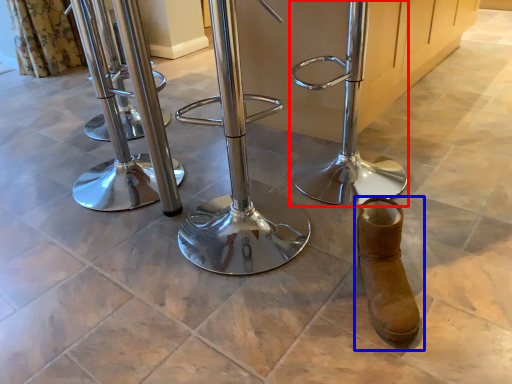
Question: Which object is further to the camera taking this photo, swivel chair (highlighted by a red box) or footwear (highlighted by a blue box)?

Choices:
 (A) swivel chair
 (B) footwear

Answer: (A)